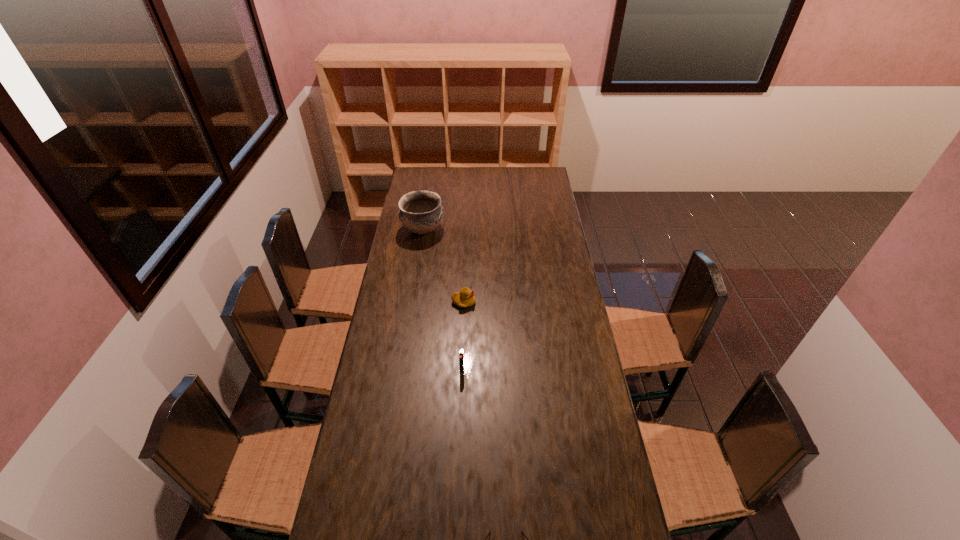
The height and width of the screenshot is (540, 960). Identify the location of free spot that satisfies the following two spatial constraints: 1. on the front-facing side of the igniter; 2. on the left side of the duckling. (461, 370).